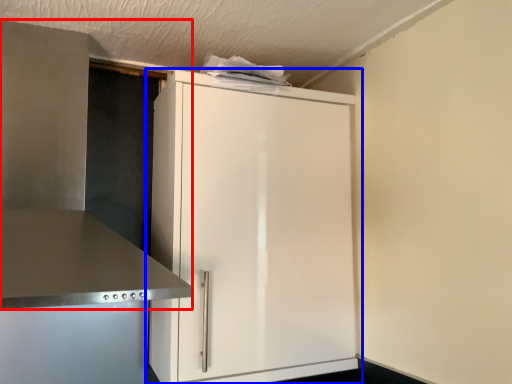
Question: Which object appears farthest to the camera in this image, vent (highlighted by a red box) or cupboard (highlighted by a blue box)?

Choices:
 (A) vent
 (B) cupboard

Answer: (B)